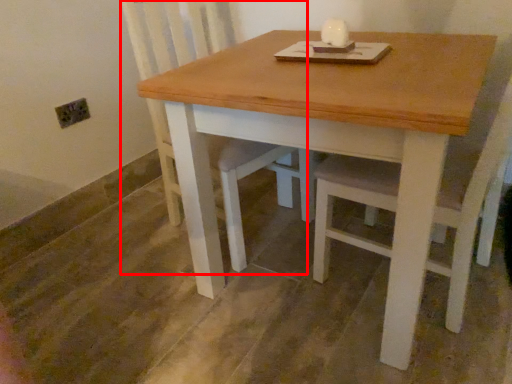
Question: From the image's perspective, considering the relative positions of swivel chair (annotated by the red box) and table in the image provided, where is swivel chair (annotated by the red box) located with respect to the staircase?

Choices:
 (A) above
 (B) below

Answer: (A)